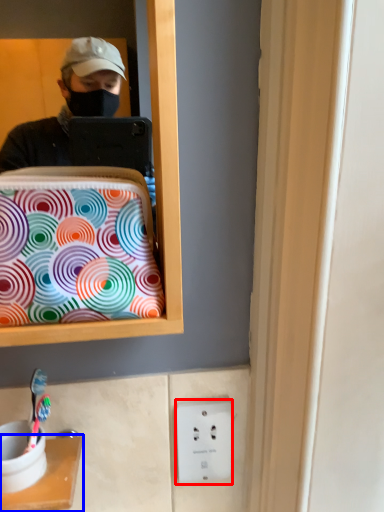
Question: Which point is closer to the camera, electric outlet (highlighted by a red box) or furniture (highlighted by a blue box)?

Choices:
 (A) electric outlet
 (B) furniture

Answer: (B)